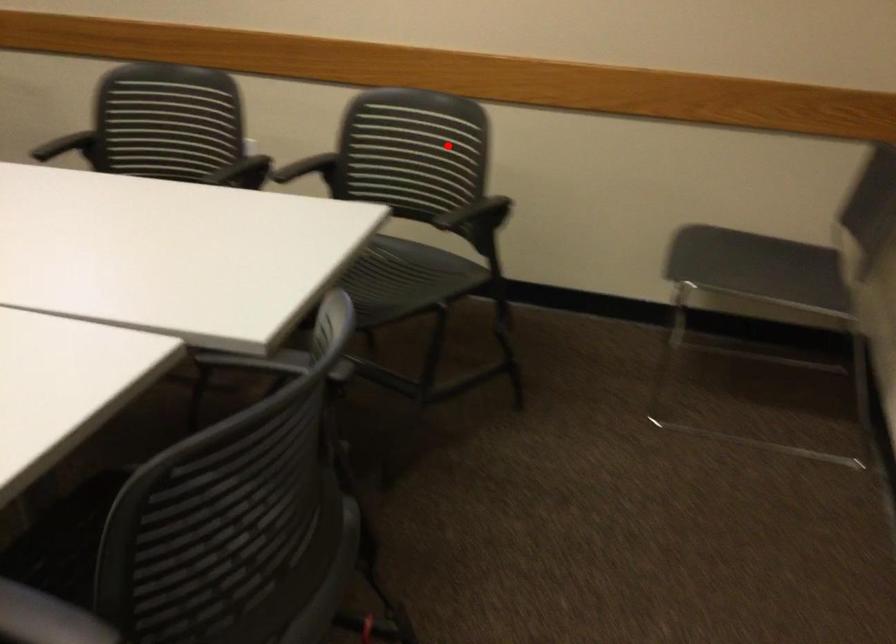
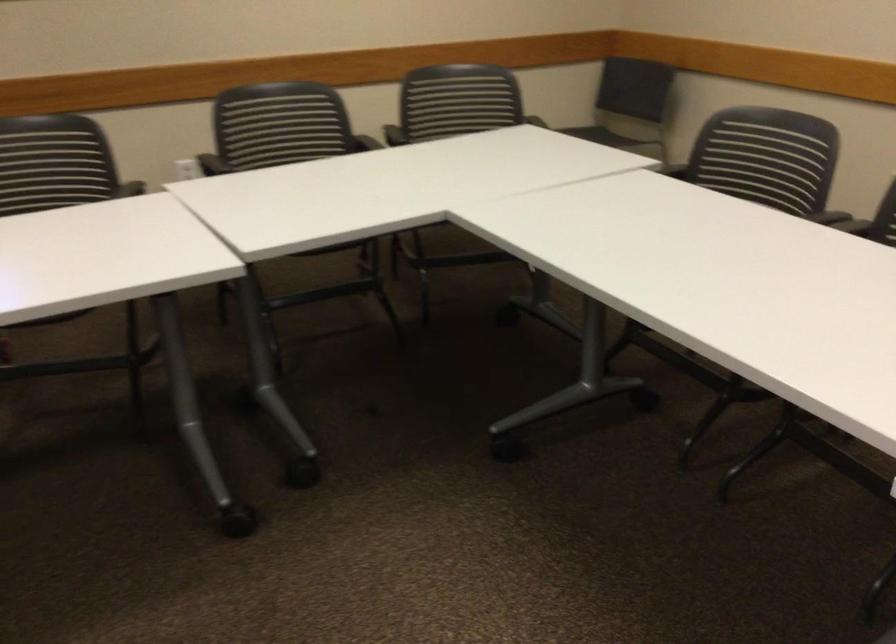
Question: I am providing you with two images of the same scene from different viewpoints. Given a red point in image1, look at the same physical point in image2. Is it:

Choices:
 (A) Closer to the viewpoint
 (B) Farther from the viewpoint

Answer: (B)